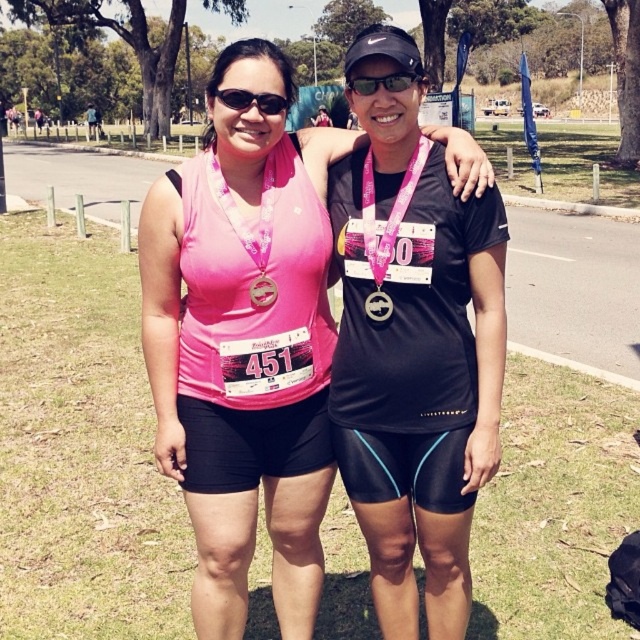
Question: Is matte pink tank top at center above black matte sunglasses at center?

Choices:
 (A) yes
 (B) no

Answer: (B)

Question: Does matte black jersey at center come in front of matte black goggles at center?

Choices:
 (A) yes
 (B) no

Answer: (A)

Question: Among these points, which one is nearest to the camera?

Choices:
 (A) (396, 83)
 (B) (381, 307)

Answer: (A)

Question: Which point is closer to the camera?

Choices:
 (A) (380, 316)
 (B) (356, 77)
 (C) (237, 104)

Answer: (B)

Question: Considering the real-world distances, which object is closest to the pink fabric medal at center?

Choices:
 (A) black matte sunglasses at center
 (B) matte pink tank top at center
 (C) matte black goggles at center

Answer: (A)

Question: Considering the relative positions of black matte sunglasses at center and metallic gold medal at center in the image provided, where is black matte sunglasses at center located with respect to metallic gold medal at center?

Choices:
 (A) right
 (B) left

Answer: (A)